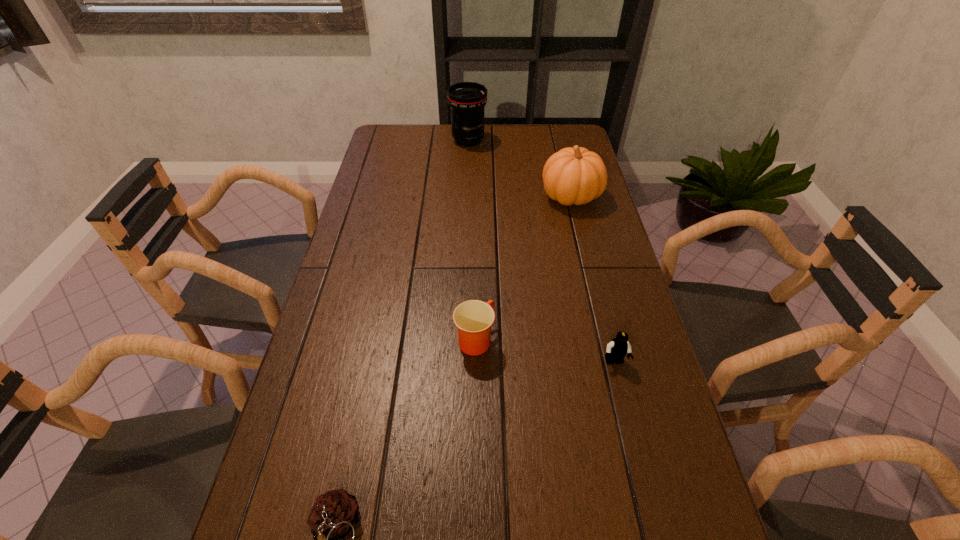
Identify the location of Lego at the right edge. (616, 350).

In the image, there is a desktop. In order to click on vacant region at the far edge in this screenshot , I will do `click(522, 124)`.

This screenshot has height=540, width=960. In the image, there is a desktop. Identify the location of free space at the left edge. (383, 204).

The image size is (960, 540). I want to click on vacant space at the right edge of the desktop, so click(659, 484).

Where is `vacant position at the far left corner of the desktop`? This screenshot has height=540, width=960. vacant position at the far left corner of the desktop is located at coordinates (397, 126).

Locate an element on the screen. This screenshot has width=960, height=540. unoccupied position between the farthest object and the Lego is located at coordinates (541, 251).

Locate an element on the screen. The height and width of the screenshot is (540, 960). vacant area that lies between the cup and the fourth nearest object is located at coordinates (523, 267).

Point out which object is positioned as the fourth nearest to the pinecone. Please provide its 2D coordinates. Your answer should be formatted as a tuple, i.e. [(x, y)], where the tuple contains the x and y coordinates of a point satisfying the conditions above.

[(467, 100)]

Locate an element on the screen. object that is the second nearest to the nearest object is located at coordinates (616, 350).